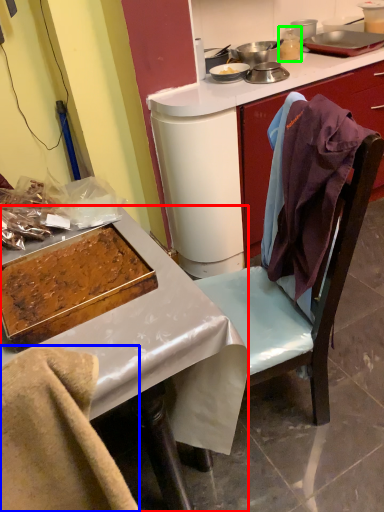
Question: Which is farther away from desk (highlighted by a red box)? leftover (highlighted by a blue box) or appliance (highlighted by a green box)?

Choices:
 (A) leftover
 (B) appliance

Answer: (B)